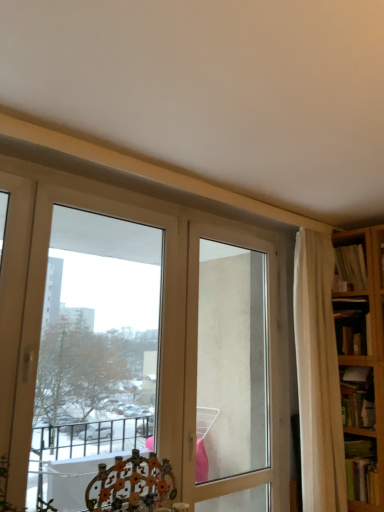
The width and height of the screenshot is (384, 512). Identify the location of white fabric curtain at right. (318, 375).

This screenshot has height=512, width=384. What do you see at coordinates (95, 346) in the screenshot? I see `transparent glass window at upper left` at bounding box center [95, 346].

This screenshot has height=512, width=384. Find the location of `hardcover book at lower right, the first book when ordered from bottom to top`. hardcover book at lower right, the first book when ordered from bottom to top is located at coordinates (361, 470).

The image size is (384, 512). Find the location of `hardcover book at right, which appears as the fourth book when ordered from the bottom`. hardcover book at right, which appears as the fourth book when ordered from the bottom is located at coordinates (351, 266).

What do you see at coordinates (132, 485) in the screenshot?
I see `metallic floral chair at lower center` at bounding box center [132, 485].

Measure the distance between point (96, 508) and camera.

7.33 feet.

The height and width of the screenshot is (512, 384). What do you see at coordinates (357, 397) in the screenshot?
I see `hardcover book at right, the 2th book from the bottom` at bounding box center [357, 397].

Identify the location of wooden bookshelf at right, which appears as the second book when viewed from the top. This screenshot has height=512, width=384. (352, 326).

In terms of height, does transparent glass screen door at center look taller or shorter compared to hardcover book at lower right, which is the fourth book in top-to-bottom order?

In the image, transparent glass screen door at center appears to be taller than hardcover book at lower right, which is the fourth book in top-to-bottom order.

Is point (277, 490) farther from viewer compared to point (346, 438)?

Yes.

Considering the sizes of objects transparent glass screen door at center and hardcover book at lower right, the first book when ordered from bottom to top, in the image provided, who is wider, transparent glass screen door at center or hardcover book at lower right, the first book when ordered from bottom to top,?

hardcover book at lower right, the first book when ordered from bottom to top.

Is hardcover book at lower right, the first book when ordered from bottom to top, positioned in front of white fabric curtain at right?

No, hardcover book at lower right, the first book when ordered from bottom to top, is behind white fabric curtain at right.

Which book is the 1st one when counting from the right side of the white fabric curtain at right? Please provide its 2D coordinates.

[(361, 470)]

From the image's perspective, is hardcover book at lower right, the first book when ordered from bottom to top, on top of white fabric curtain at right?

No, from the image's perspective, hardcover book at lower right, the first book when ordered from bottom to top, is not over white fabric curtain at right.

Which is more to the left, white fabric curtain at right or transparent glass window at upper left?

Positioned to the left is transparent glass window at upper left.

Is white fabric curtain at right positioned far away from transparent glass window at upper left?

Yes, white fabric curtain at right is far from transparent glass window at upper left.

Could you tell me if white fabric curtain at right is turned towards transparent glass window at upper left?

No.

Does white fabric curtain at right have a lesser width compared to transparent glass window at upper left?

In fact, white fabric curtain at right might be wider than transparent glass window at upper left.

Is hardcover book at lower right, the first book when ordered from bottom to top, further to camera compared to transparent glass screen door at center?

That is True.

Is hardcover book at lower right, which is the fourth book in top-to-bottom order, shorter than transparent glass screen door at center?

Yes.

Is hardcover book at lower right, the first book when ordered from bottom to top, positioned with its back to transparent glass screen door at center?

hardcover book at lower right, the first book when ordered from bottom to top, does not have its back to transparent glass screen door at center.

Considering the positions of objects metallic floral chair at lower center and transparent glass screen door at center in the image provided, who is more to the right, metallic floral chair at lower center or transparent glass screen door at center?

From the viewer's perspective, transparent glass screen door at center appears more on the right side.

Is metallic floral chair at lower center inside or outside of transparent glass screen door at center?

metallic floral chair at lower center is outside transparent glass screen door at center.

At what (x,y) coordinates should I click in order to perform the action: click on chair below the transparent glass screen door at center (from the image's perspective). Please return your answer as a coordinate pair (x, y). Looking at the image, I should click on (132, 485).

Between transparent glass window at upper left and hardcover book at right, the 3th book when ordered from top to bottom, which one has more height?

transparent glass window at upper left is taller.

Considering the sizes of objects transparent glass window at upper left and hardcover book at right, the 2th book from the bottom, in the image provided, who is bigger, transparent glass window at upper left or hardcover book at right, the 2th book from the bottom,?

Bigger between the two is transparent glass window at upper left.

From a real-world perspective, is transparent glass window at upper left physically above hardcover book at right, the 3th book when ordered from top to bottom?

Yes, from a real-world perspective, transparent glass window at upper left is on top of hardcover book at right, the 3th book when ordered from top to bottom.

You are a GUI agent. You are given a task and a screenshot of the screen. Output one action in this format:
    pyautogui.click(x=<x>, y=<y>)
    Task: Click on the book lying on the left of hardcover book at right, the 2th book from the bottom
    
    Given the screenshot: What is the action you would take?
    pyautogui.click(x=361, y=470)

Does point (369, 496) come closer to viewer compared to point (346, 416)?

Yes, point (369, 496) is closer to viewer.

How different are the orientations of hardcover book at lower right, the first book when ordered from bottom to top, and hardcover book at right, the 3th book when ordered from top to bottom, in degrees?

0.000741 degrees separate the facing orientations of hardcover book at lower right, the first book when ordered from bottom to top, and hardcover book at right, the 3th book when ordered from top to bottom.

Which object is positioned more to the left, hardcover book at lower right, which is the fourth book in top-to-bottom order, or hardcover book at right, the 3th book when ordered from top to bottom?

Positioned to the left is hardcover book at lower right, which is the fourth book in top-to-bottom order.

Find the location of a particular element. Image resolution: width=384 pixels, height=512 pixels. screen door that appears in front of the hardcover book at lower right, which is the fourth book in top-to-bottom order is located at coordinates (x=231, y=362).

Find the location of a particular element. curtain above the hardcover book at lower right, the first book when ordered from bottom to top (from the image's perspective) is located at coordinates (318, 375).

Looking at the image, which one is located further to hardcover book at right, the 2th book from the bottom, transparent glass screen door at center or white fabric curtain at right?

The object further to hardcover book at right, the 2th book from the bottom, is transparent glass screen door at center.

When comparing their distances from hardcover book at lower right, the first book when ordered from bottom to top, does transparent glass window at upper left or hardcover book at right, the 3th book when ordered from top to bottom, seem further?

The object further to hardcover book at lower right, the first book when ordered from bottom to top, is transparent glass window at upper left.

Looking at the image, which one is located further to white fabric curtain at right, hardcover book at lower right, which is the fourth book in top-to-bottom order, or hardcover book at right, the 2th book from the bottom?

hardcover book at lower right, which is the fourth book in top-to-bottom order, is positioned further to the anchor white fabric curtain at right.

Which object lies nearer to the anchor point transparent glass screen door at center, metallic floral chair at lower center or transparent glass window at upper left?

Among the two, metallic floral chair at lower center is located nearer to transparent glass screen door at center.

Considering their positions, is transparent glass window at upper left positioned further to wooden bookshelf at right, which appears as the second book when viewed from the top, than hardcover book at right, which appears as the 1th book when viewed from the top?

transparent glass window at upper left is further to wooden bookshelf at right, which appears as the second book when viewed from the top.

Looking at the image, which one is located further to metallic floral chair at lower center, wooden bookshelf at right, which appears as the second book when viewed from the top, or hardcover book at lower right, which is the fourth book in top-to-bottom order?

wooden bookshelf at right, which appears as the second book when viewed from the top, is positioned further to the anchor metallic floral chair at lower center.

Considering their positions, is transparent glass window at upper left positioned further to wooden bookshelf at right, which appears as the second book when viewed from the top, than white fabric curtain at right?

Based on the image, transparent glass window at upper left appears to be further to wooden bookshelf at right, which appears as the second book when viewed from the top.

When comparing their distances from hardcover book at right, the 2th book from the bottom, does transparent glass screen door at center or transparent glass window at upper left seem closer?

Based on the image, transparent glass screen door at center appears to be nearer to hardcover book at right, the 2th book from the bottom.

Locate an element on the screen. curtain between wooden bookshelf at right, which appears as the second book when viewed from the top, and hardcover book at right, the 2th book from the bottom, vertically is located at coordinates (318, 375).

I want to click on curtain between metallic floral chair at lower center and hardcover book at lower right, which is the fourth book in top-to-bottom order, from left to right, so click(318, 375).

Identify the location of curtain between transparent glass screen door at center and hardcover book at right, the 2th book from the bottom, from left to right. Image resolution: width=384 pixels, height=512 pixels. (318, 375).

You are a GUI agent. You are given a task and a screenshot of the screen. Output one action in this format:
    pyautogui.click(x=<x>, y=<y>)
    Task: Click on the screen door situated between metallic floral chair at lower center and hardcover book at right, which appears as the fourth book when ordered from the bottom, from left to right
    
    Given the screenshot: What is the action you would take?
    pyautogui.click(x=231, y=362)